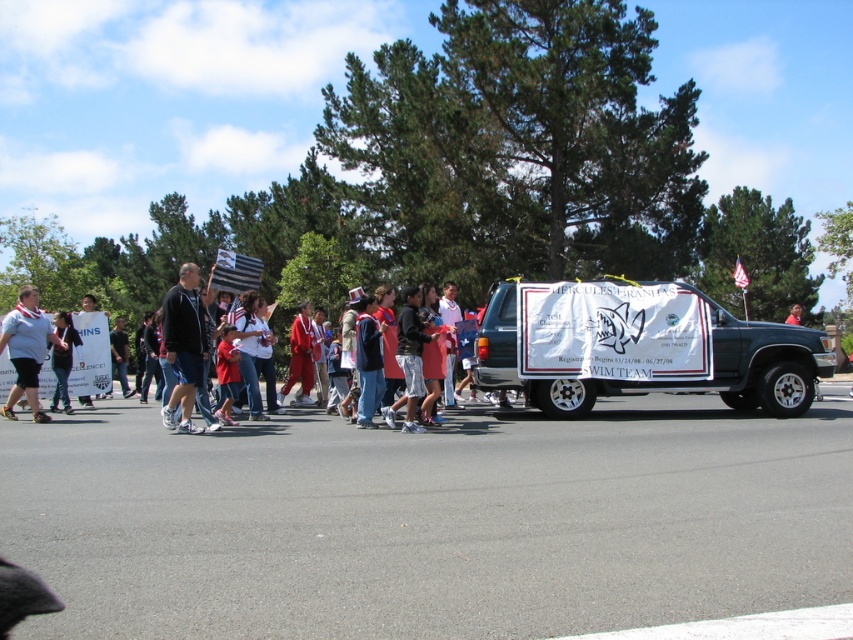
You are standing at point (15,346). You want to walk to the nearest tree in the background. How far will you have to walk?

The distance between you and the nearest tree is 12.22 meters, so you will have to walk 12.22 meters.